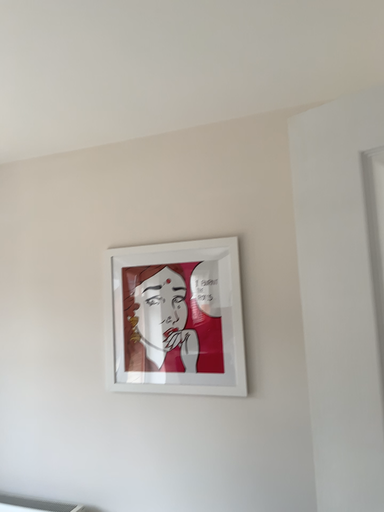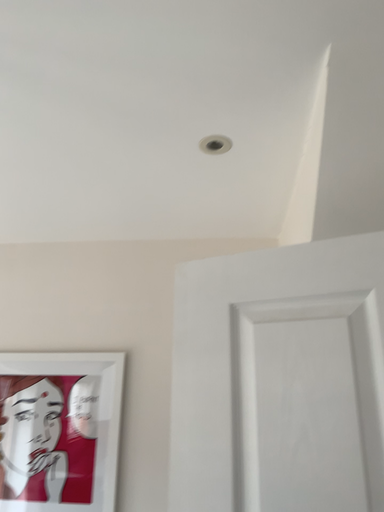
Question: How did the camera likely rotate when shooting the video?

Choices:
 (A) rotated right
 (B) rotated left

Answer: (A)